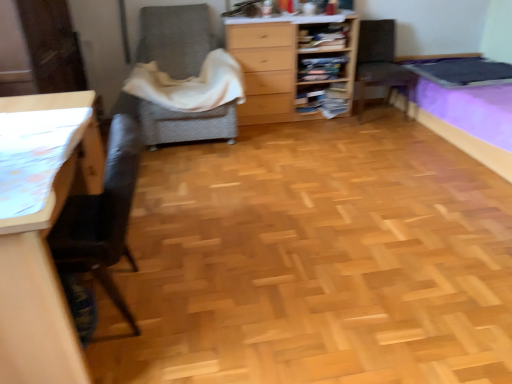
Question: From a real-world perspective, does white soft blanket at center stand above wooden chest of drawers at center?

Choices:
 (A) no
 (B) yes

Answer: (B)

Question: Is white soft blanket at center outside of wooden chest of drawers at center?

Choices:
 (A) no
 (B) yes

Answer: (B)

Question: Is white soft blanket at center facing towards wooden chest of drawers at center?

Choices:
 (A) yes
 (B) no

Answer: (B)

Question: Is white soft blanket at center not close to wooden chest of drawers at center?

Choices:
 (A) yes
 (B) no

Answer: (B)

Question: Is white soft blanket at center to the right of wooden chest of drawers at center from the viewer's perspective?

Choices:
 (A) yes
 (B) no

Answer: (B)

Question: Does white soft blanket at center have a lesser height compared to wooden chest of drawers at center?

Choices:
 (A) no
 (B) yes

Answer: (B)

Question: Can you confirm if wooden chest of drawers at center is wider than wooden bookshelf at center, marked as the first shelf in a bottom-to-top arrangement?

Choices:
 (A) no
 (B) yes

Answer: (B)

Question: From a real-world perspective, is wooden chest of drawers at center positioned under wooden bookshelf at center, the third shelf from the top, based on gravity?

Choices:
 (A) yes
 (B) no

Answer: (B)

Question: Can you confirm if wooden chest of drawers at center is thinner than wooden bookshelf at center, marked as the first shelf in a bottom-to-top arrangement?

Choices:
 (A) no
 (B) yes

Answer: (A)

Question: Considering the relative sizes of wooden chest of drawers at center and wooden bookshelf at center, the third shelf from the top, in the image provided, is wooden chest of drawers at center smaller than wooden bookshelf at center, the third shelf from the top,?

Choices:
 (A) no
 (B) yes

Answer: (A)

Question: From a real-world perspective, is wooden chest of drawers at center on top of wooden bookshelf at center, marked as the first shelf in a bottom-to-top arrangement?

Choices:
 (A) yes
 (B) no

Answer: (A)

Question: Is wooden chest of drawers at center oriented towards wooden bookshelf at center, marked as the first shelf in a bottom-to-top arrangement?

Choices:
 (A) no
 (B) yes

Answer: (B)

Question: Is wooden bookshelf at center, marked as the first shelf in a bottom-to-top arrangement, taller than brown fabric chair at upper right, the 2th chair viewed from the left?

Choices:
 (A) no
 (B) yes

Answer: (A)